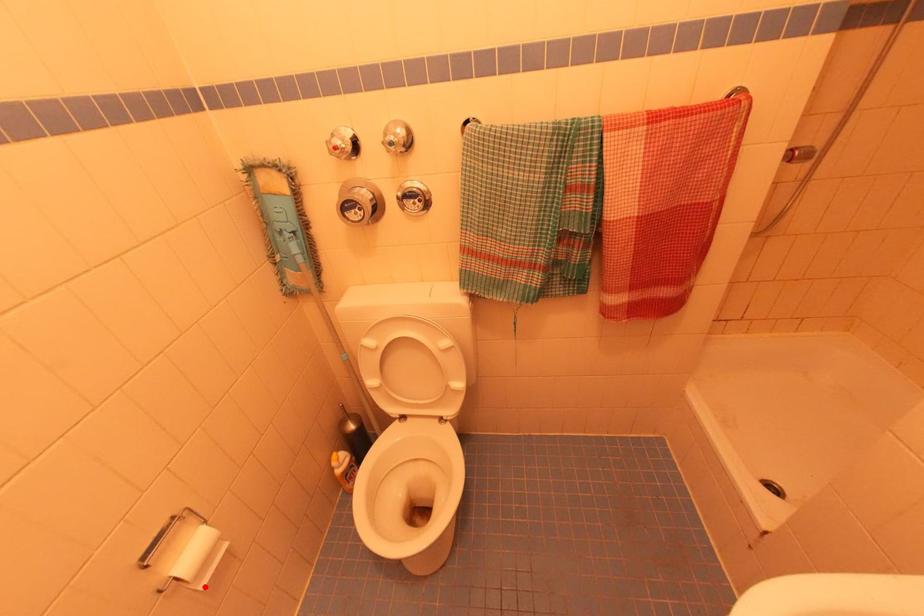
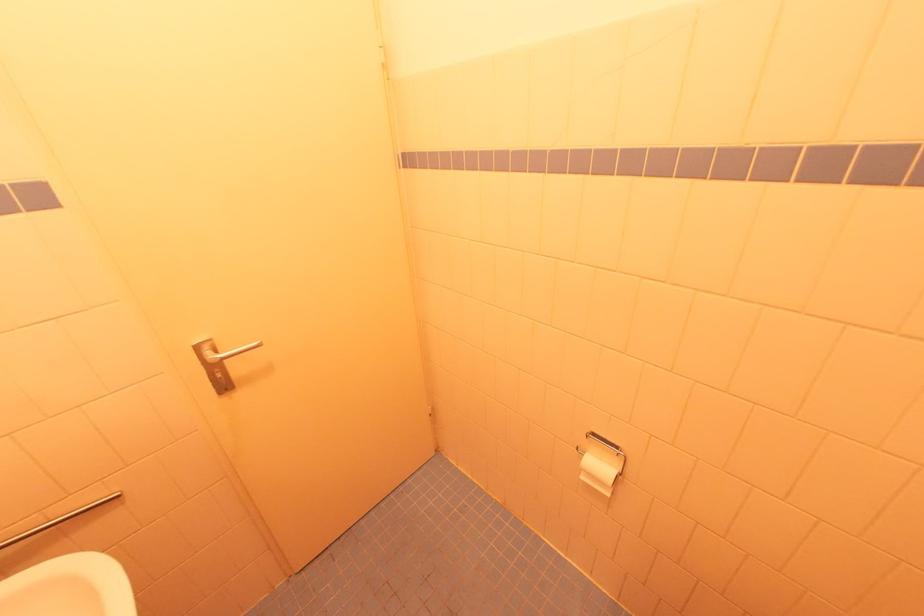
The point at the highlighted location is marked in the first image. Where is the corresponding point in the second image?

(585, 479)